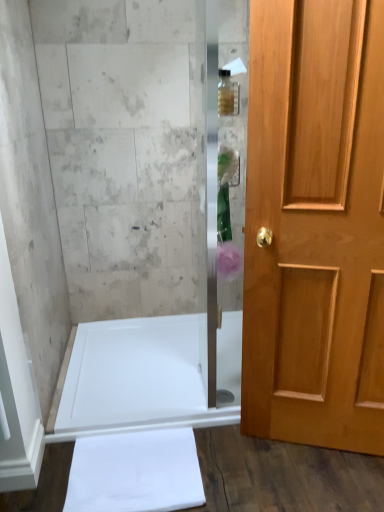
Question: Is translucent glass bottle at upper center to the left of white glossy bathtub at lower left from the viewer's perspective?

Choices:
 (A) no
 (B) yes

Answer: (A)

Question: Can you confirm if translucent glass bottle at upper center is taller than white glossy bathtub at lower left?

Choices:
 (A) yes
 (B) no

Answer: (A)

Question: From a real-world perspective, is translucent glass bottle at upper center physically above white glossy bathtub at lower left?

Choices:
 (A) yes
 (B) no

Answer: (A)

Question: Does translucent glass bottle at upper center touch white glossy bathtub at lower left?

Choices:
 (A) yes
 (B) no

Answer: (B)

Question: Is translucent glass bottle at upper center at the right side of white glossy bathtub at lower left?

Choices:
 (A) no
 (B) yes

Answer: (B)

Question: From a real-world perspective, is translucent pink flower at center positioned above or below light brown wooden door at right?

Choices:
 (A) below
 (B) above

Answer: (A)

Question: Which is correct: translucent pink flower at center is inside light brown wooden door at right, or outside of it?

Choices:
 (A) outside
 (B) inside

Answer: (A)

Question: From the image's perspective, is translucent pink flower at center above or below light brown wooden door at right?

Choices:
 (A) below
 (B) above

Answer: (A)

Question: Relative to light brown wooden door at right, is translucent pink flower at center in front or behind?

Choices:
 (A) front
 (B) behind

Answer: (B)

Question: From a real-world perspective, is translucent pink flower at center positioned above or below white glossy bathtub at lower left?

Choices:
 (A) above
 (B) below

Answer: (A)

Question: Based on their sizes in the image, would you say translucent pink flower at center is bigger or smaller than white glossy bathtub at lower left?

Choices:
 (A) big
 (B) small

Answer: (B)

Question: Considering the positions of translucent pink flower at center and white glossy bathtub at lower left in the image, is translucent pink flower at center taller or shorter than white glossy bathtub at lower left?

Choices:
 (A) tall
 (B) short

Answer: (A)

Question: Considering the positions of translucent pink flower at center and white glossy bathtub at lower left in the image, is translucent pink flower at center wider or thinner than white glossy bathtub at lower left?

Choices:
 (A) thin
 (B) wide

Answer: (A)

Question: Choose the correct answer: Is white glossy bathtub at lower left inside translucent glass bottle at upper center or outside it?

Choices:
 (A) inside
 (B) outside

Answer: (B)

Question: In the image, is white glossy bathtub at lower left on the left side or the right side of translucent glass bottle at upper center?

Choices:
 (A) right
 (B) left

Answer: (B)